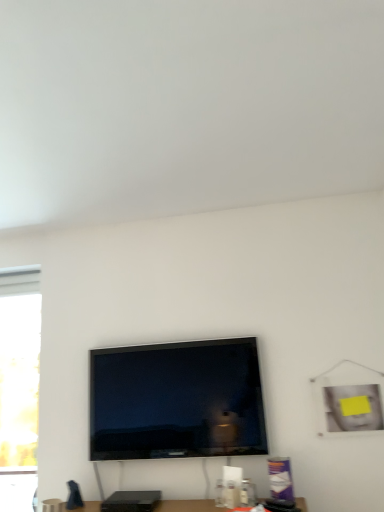
Question: Is matte black speaker at lower center turned away from matte black tv at center?

Choices:
 (A) no
 (B) yes

Answer: (A)

Question: Is matte black speaker at lower center far from matte black tv at center?

Choices:
 (A) yes
 (B) no

Answer: (B)

Question: From the image's perspective, is matte black speaker at lower center under matte black tv at center?

Choices:
 (A) no
 (B) yes

Answer: (B)

Question: Is the position of matte black speaker at lower center more distant than that of matte black tv at center?

Choices:
 (A) no
 (B) yes

Answer: (A)

Question: From a real-world perspective, is matte black speaker at lower center below matte black tv at center?

Choices:
 (A) yes
 (B) no

Answer: (A)

Question: Is translucent glass window at left situated inside matte black speaker at lower center or outside?

Choices:
 (A) outside
 (B) inside

Answer: (A)

Question: From a real-world perspective, relative to matte black speaker at lower center, is translucent glass window at left vertically above or below?

Choices:
 (A) below
 (B) above

Answer: (B)

Question: Based on their positions, is translucent glass window at left located to the left or right of matte black speaker at lower center?

Choices:
 (A) left
 (B) right

Answer: (A)

Question: Is point (3, 402) positioned closer to the camera than point (165, 504)?

Choices:
 (A) farther
 (B) closer

Answer: (A)

Question: Does point (185, 501) appear closer or farther from the camera than point (231, 369)?

Choices:
 (A) farther
 (B) closer

Answer: (B)

Question: Considering the positions of matte black speaker at lower center and matte black tv at center in the image, is matte black speaker at lower center wider or thinner than matte black tv at center?

Choices:
 (A) wide
 (B) thin

Answer: (A)

Question: Considering their positions, is matte black speaker at lower center located in front of or behind matte black tv at center?

Choices:
 (A) front
 (B) behind

Answer: (A)

Question: From their relative heights in the image, would you say matte black speaker at lower center is taller or shorter than matte black tv at center?

Choices:
 (A) short
 (B) tall

Answer: (A)

Question: Considering the positions of translucent glass window at left and matte black tv at center in the image, is translucent glass window at left taller or shorter than matte black tv at center?

Choices:
 (A) short
 (B) tall

Answer: (B)

Question: From a real-world perspective, relative to matte black tv at center, is translucent glass window at left vertically above or below?

Choices:
 (A) above
 (B) below

Answer: (B)